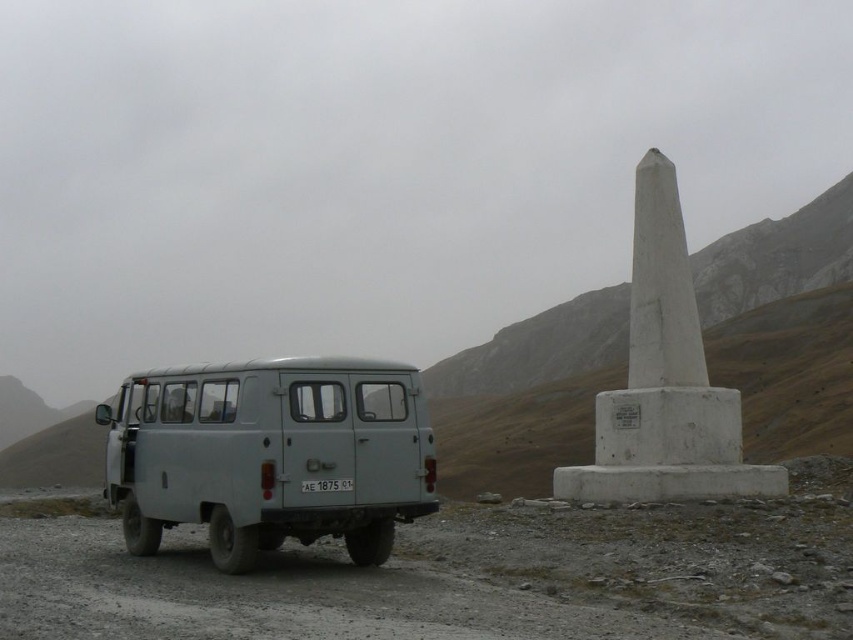
You are a photographer trying to capture the matte gray van at left and the white plastic license plate at center in a single shot. Since you want both objects to be clearly visible, which one should you focus on first to ensure sharpness?

You should focus on the matte gray van at left first because it is closer to the viewer than the white plastic license plate at center, ensuring that it will be in focus while the license plate may appear slightly blurred. To capture both clearly, adjust your camera settings for a smaller aperture to increase depth of field.

You are a delivery driver who needs to load a large package into the van. The package is too big to fit through the rear doors. You notice the white concrete obelisk at right and the white plastic license plate at center. Which object is bigger and could potentially block the path if moved?

The white concrete obelisk at right is larger in size compared to the white plastic license plate at center, so moving it might block the path more significantly.